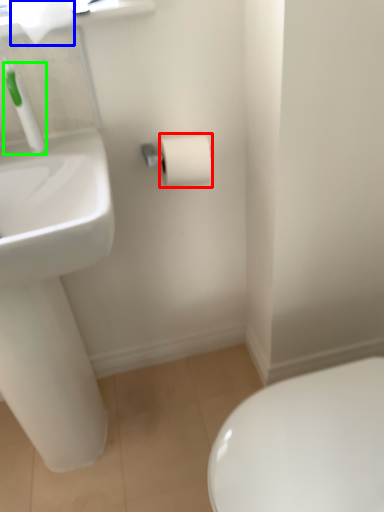
Question: Which object is the farthest from toilet paper (highlighted by a red box)? Choose among these: toilet paper (highlighted by a blue box) or plumbing fixture (highlighted by a green box).

Choices:
 (A) toilet paper
 (B) plumbing fixture

Answer: (A)